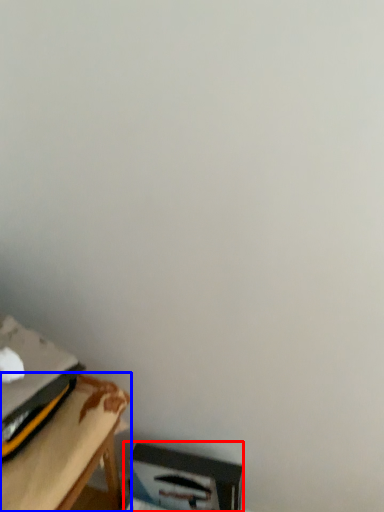
Question: Among these objects, which one is nearest to the camera, cardboard box (highlighted by a red box) or table (highlighted by a blue box)?

Choices:
 (A) cardboard box
 (B) table

Answer: (B)